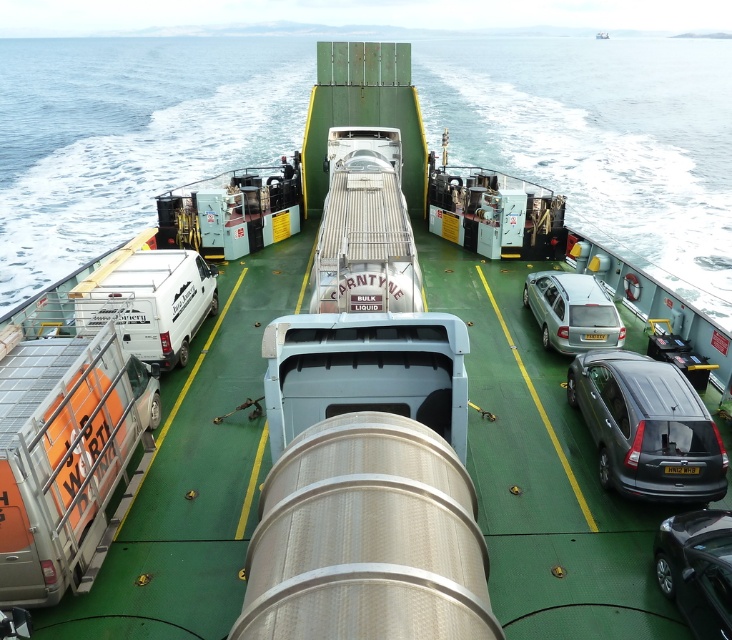
What do you see at coordinates (601, 138) in the screenshot?
I see `clear blue water at center` at bounding box center [601, 138].

Does clear blue water at center have a lesser width compared to shiny black sedan at lower right?

In fact, clear blue water at center might be wider than shiny black sedan at lower right.

Locate an element on the screen. The width and height of the screenshot is (732, 640). clear blue water at center is located at coordinates (601, 138).

Is shiny black sedan at lower right positioned before yellow matte license plate at center?

Yes.

Who is more distant from viewer, (676, 545) or (668, 474)?

Point (668, 474)

Identify the location of shiny black sedan at lower right. This screenshot has width=732, height=640. (698, 568).

The width and height of the screenshot is (732, 640). In order to click on shiny black sedan at lower right in this screenshot , I will do `click(698, 568)`.

Can you confirm if metallic gray hatchback at center right is bigger than shiny black sedan at lower right?

Yes, metallic gray hatchback at center right is bigger than shiny black sedan at lower right.

Which is behind, point (672, 451) or point (701, 627)?

The point (672, 451) is more distant.

Find the location of a particular element. metallic gray hatchback at center right is located at coordinates (646, 426).